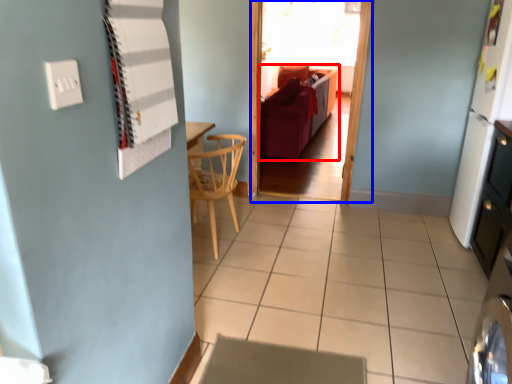
Question: Which of the following is the farthest to the observer, studio couch (highlighted by a red box) or glass door (highlighted by a blue box)?

Choices:
 (A) studio couch
 (B) glass door

Answer: (A)